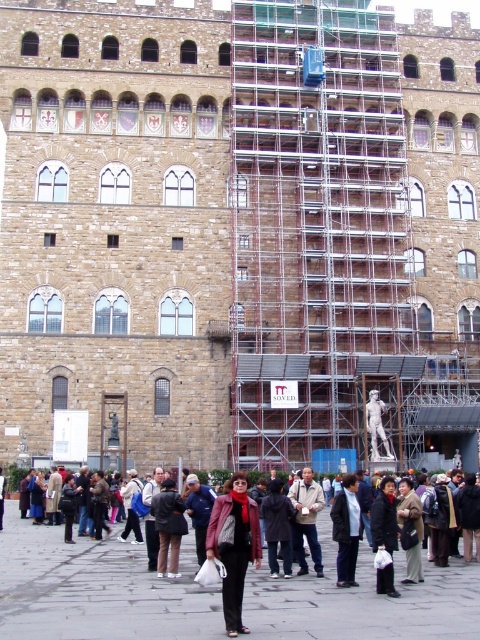
Question: Is scaffolding metal at center wider than light brown leather jacket at center?

Choices:
 (A) yes
 (B) no

Answer: (A)

Question: Among these objects, which one is nearest to the camera?

Choices:
 (A) leather jacket at center
 (B) dark brown leather jacket at lower center
 (C) scaffolding metal at center
 (D) light brown leather jacket at center

Answer: (B)

Question: Which object appears farthest from the camera in this image?

Choices:
 (A) leather jacket at center
 (B) dark brown leather jacket at lower center

Answer: (A)

Question: Which point is farther from the camera taking this photo?

Choices:
 (A) (247, 230)
 (B) (247, 547)

Answer: (A)

Question: Can you confirm if leather jacket at center is bigger than light brown leather jacket at center?

Choices:
 (A) no
 (B) yes

Answer: (B)

Question: Does scaffolding metal at center appear under leather jacket at center?

Choices:
 (A) yes
 (B) no

Answer: (B)